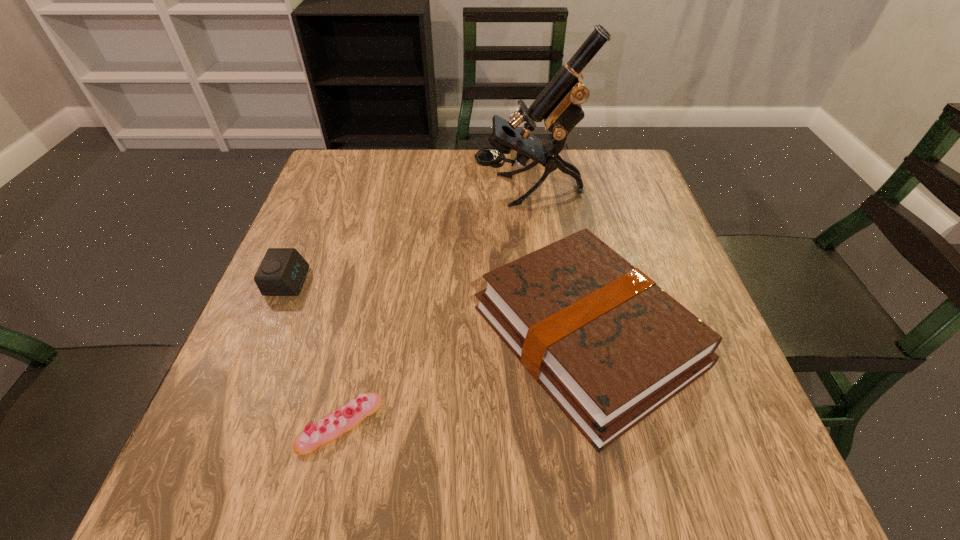
Identify the location of the tallest object. The image size is (960, 540). (559, 104).

Locate an element on the screen. Image resolution: width=960 pixels, height=540 pixels. the farthest object is located at coordinates (559, 104).

Locate an element on the screen. the second tallest object is located at coordinates (610, 347).

Locate an element on the screen. Image resolution: width=960 pixels, height=540 pixels. alarm clock is located at coordinates (282, 272).

Identify the location of the leftmost object. (282, 272).

Where is `the third object from right to left`? The image size is (960, 540). the third object from right to left is located at coordinates (331, 427).

What are the coordinates of `eclair` in the screenshot? It's located at (331, 427).

This screenshot has width=960, height=540. Identify the location of vacant space located 0.330m through the eyepiece of the farthest object. (348, 191).

Find the location of a particular element. The height and width of the screenshot is (540, 960). vacant region located 0.320m through the eyepiece of the farthest object is located at coordinates (352, 191).

Identify the location of free location located through the eyepiece of the farthest object. This screenshot has height=540, width=960. (387, 191).